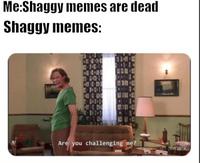
Locate an element on the screen. patterned curtains is located at coordinates (97, 90).